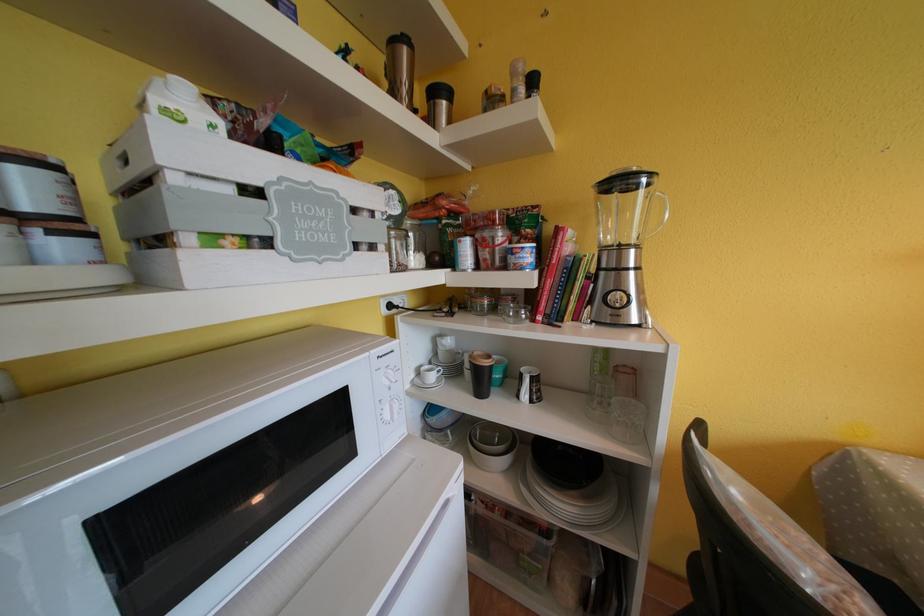
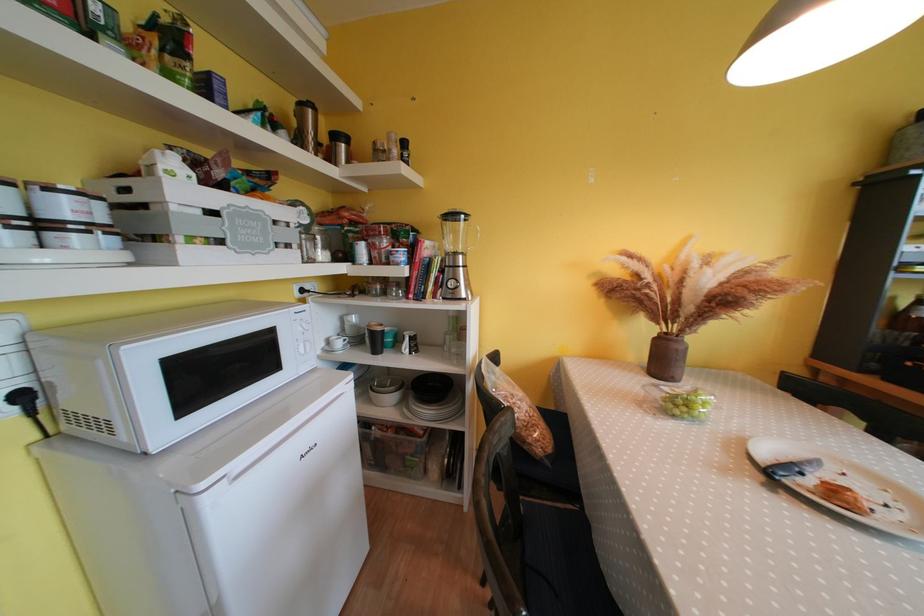
In the second image, find the point that corresponds to point 399,46 in the first image.

(308, 108)